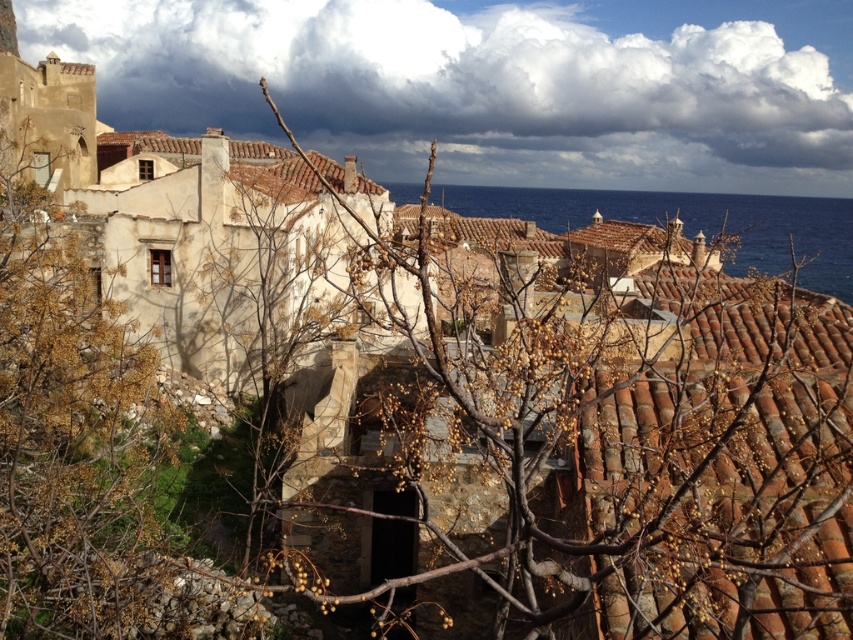
You are standing in the coastal town and want to take a photo of the blue water at center and the brown tile roof at center. Which object should you focus on first if you want both to be in clear focus?

The brown tile roof at center should be focused on first because it is closer to the viewer than the blue water at center, ensuring both will be in focus when using depth of field techniques.

You are standing at the edge of the coastal town and want to reach the blue water at center. According to the coordinates provided, in which direction should you move relative to your current position?

The blue water at center is located at coordinates point (x=692, y=221). Since the coordinate system typically has (x=0, y=0) at the bottom left corner, moving towards the right and upwards from your current position would lead you to the blue water at center.

You are standing in the coastal town and want to take a photo of both point (541, 256) and point (144, 131). Which point should you focus on first to ensure both are in clear view?

You should focus on point (541, 256) first because it is closer to the camera than point (144, 131), ensuring both points are in focus.